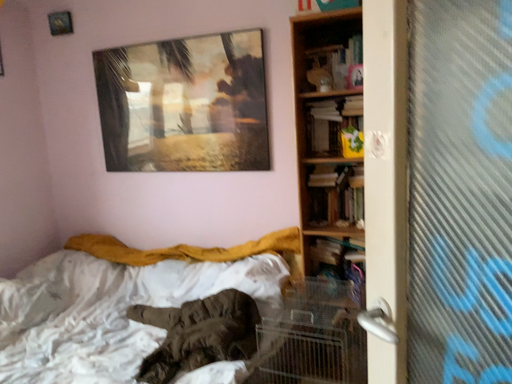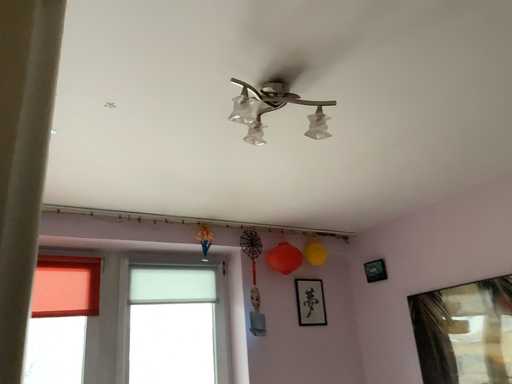
Question: How did the camera likely rotate when shooting the video?

Choices:
 (A) rotated left
 (B) rotated right

Answer: (A)